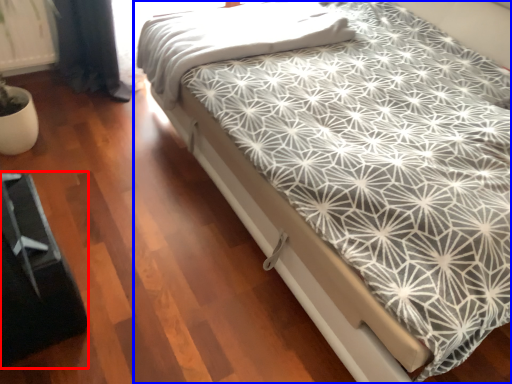
Question: Which object appears closest to the camera in this image, bed frame (highlighted by a red box) or bed (highlighted by a blue box)?

Choices:
 (A) bed frame
 (B) bed

Answer: (B)